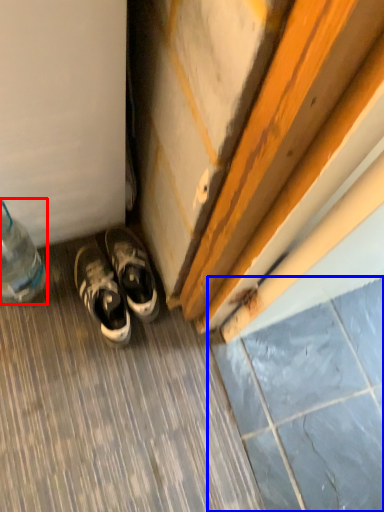
Question: Which object is closer to the camera taking this photo, bottle (highlighted by a red box) or tile (highlighted by a blue box)?

Choices:
 (A) bottle
 (B) tile

Answer: (A)